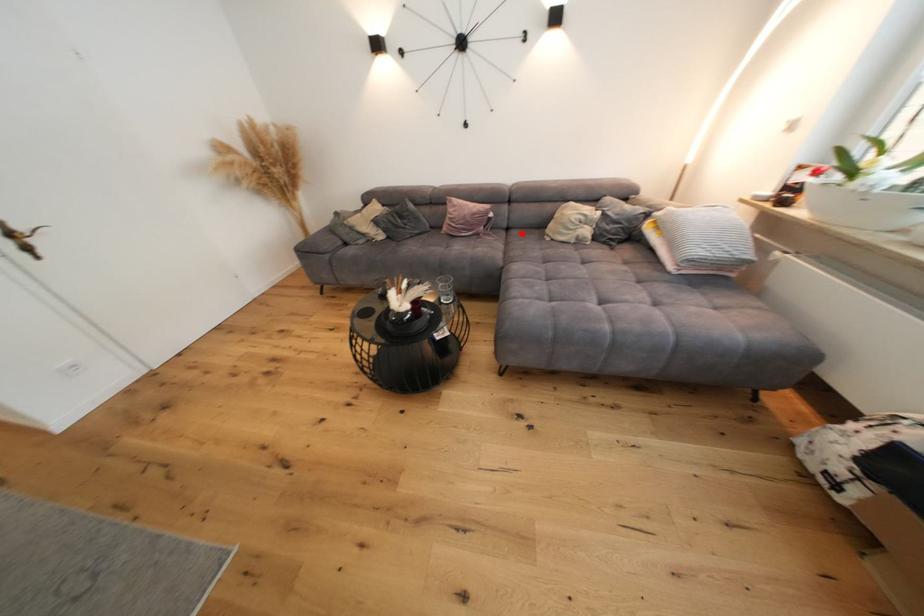
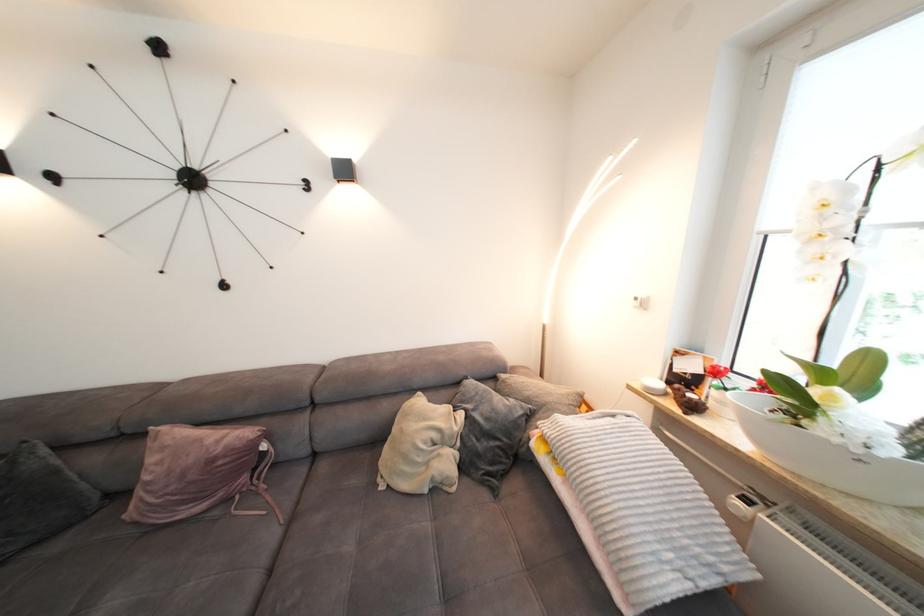
Question: I am providing you with two images of the same scene from different viewpoints. In image1, a red point is highlighted. Considering the same 3D point in image2, which of the following is correct?

Choices:
 (A) It is closer
 (B) It is farther

Answer: (B)